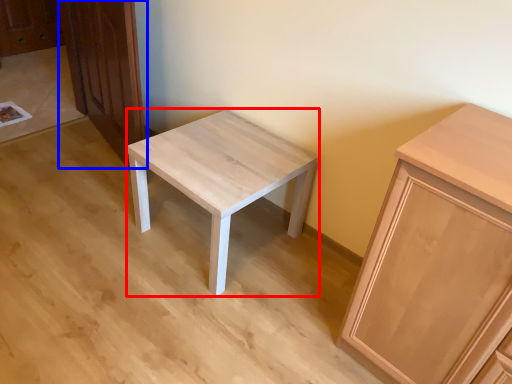
Question: Which object appears closest to the camera in this image, stool (highlighted by a red box) or dresser (highlighted by a blue box)?

Choices:
 (A) stool
 (B) dresser

Answer: (A)